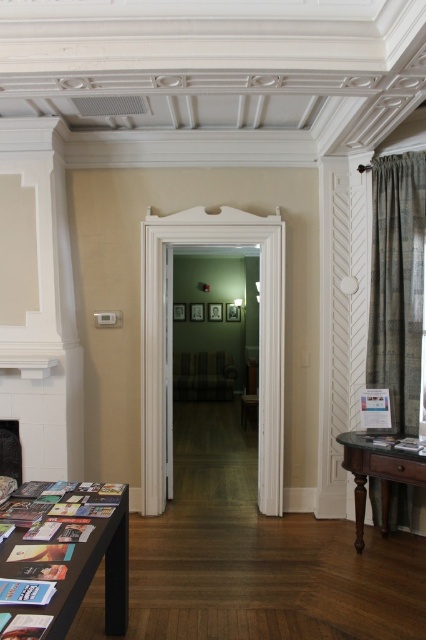
Between textured green curtain at right and mahogany wood table at right, which one appears on the left side from the viewer's perspective?

mahogany wood table at right is more to the left.

Locate an element on the screen. This screenshot has width=426, height=640. textured green curtain at right is located at coordinates (397, 284).

In order to click on textured green curtain at right in this screenshot , I will do `click(397, 284)`.

Can you confirm if mahogany wood table at right is positioned above black stone fireplace at lower left?

Actually, mahogany wood table at right is below black stone fireplace at lower left.

Is mahogany wood table at right further to camera compared to black stone fireplace at lower left?

No, mahogany wood table at right is in front of black stone fireplace at lower left.

In order to click on mahogany wood table at right in this screenshot , I will do `click(377, 474)`.

Is the position of black glossy table at lower left less distant than that of mahogany wood table at right?

Yes, black glossy table at lower left is in front of mahogany wood table at right.

Is point (121, 529) farther from viewer compared to point (354, 547)?

No, it is not.

Find the location of `black glossy table at lower left`. black glossy table at lower left is located at coordinates (94, 573).